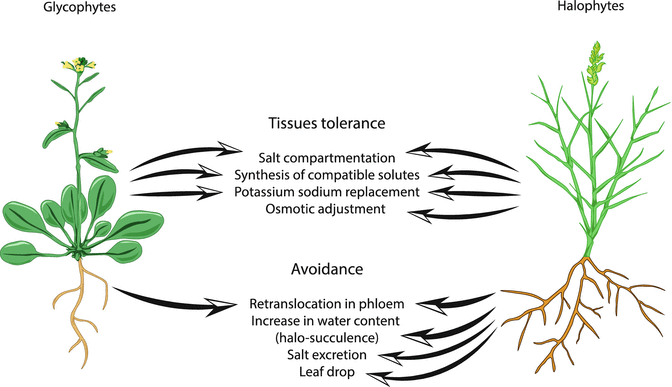
Locate an element on the screen. The height and width of the screenshot is (387, 672). empty space right of left plant is located at coordinates (216, 246).